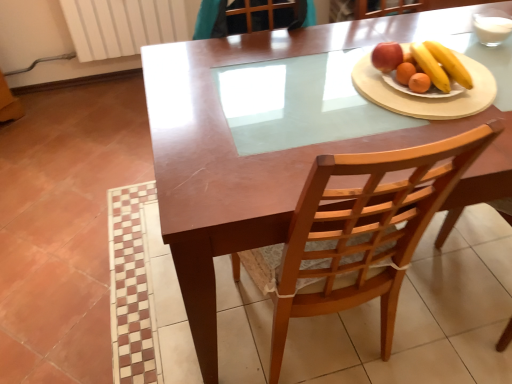
Question: Is white ceramic plate at upper right thinner than wooden chair at center?

Choices:
 (A) yes
 (B) no

Answer: (A)

Question: Is white ceramic plate at upper right far away from wooden chair at center?

Choices:
 (A) yes
 (B) no

Answer: (B)

Question: Is white ceramic plate at upper right next to wooden chair at center?

Choices:
 (A) no
 (B) yes

Answer: (A)

Question: From a real-world perspective, is white ceramic plate at upper right under wooden chair at center?

Choices:
 (A) yes
 (B) no

Answer: (B)

Question: Does white ceramic plate at upper right have a lesser height compared to wooden chair at center?

Choices:
 (A) yes
 (B) no

Answer: (A)

Question: Considering their positions, is wooden chair at center located in front of or behind white ceramic plate at upper right?

Choices:
 (A) front
 (B) behind

Answer: (A)

Question: In the image, is wooden chair at center on the left side or the right side of white ceramic plate at upper right?

Choices:
 (A) right
 (B) left

Answer: (B)

Question: From the image's perspective, is wooden chair at center located above or below white ceramic plate at upper right?

Choices:
 (A) below
 (B) above

Answer: (A)

Question: In terms of width, does wooden chair at center look wider or thinner when compared to white ceramic plate at upper right?

Choices:
 (A) wide
 (B) thin

Answer: (A)

Question: Is white ceramic plate at upper right spatially inside wooden chair at center, or outside of it?

Choices:
 (A) outside
 (B) inside

Answer: (A)

Question: Considering the positions of point pyautogui.click(x=475, y=82) and point pyautogui.click(x=422, y=226), is point pyautogui.click(x=475, y=82) closer or farther from the camera than point pyautogui.click(x=422, y=226)?

Choices:
 (A) closer
 (B) farther

Answer: (B)

Question: Considering the positions of white ceramic plate at upper right and wooden chair at center in the image, is white ceramic plate at upper right bigger or smaller than wooden chair at center?

Choices:
 (A) small
 (B) big

Answer: (A)

Question: Is white ceramic plate at upper right taller or shorter than wooden chair at center?

Choices:
 (A) short
 (B) tall

Answer: (A)

Question: From a real-world perspective, relative to white ceramic plate at upper right, is smooth wooden plate with fruits at right vertically above or below?

Choices:
 (A) below
 (B) above

Answer: (B)

Question: Looking at the image, does smooth wooden plate with fruits at right seem bigger or smaller compared to white ceramic plate at upper right?

Choices:
 (A) small
 (B) big

Answer: (A)